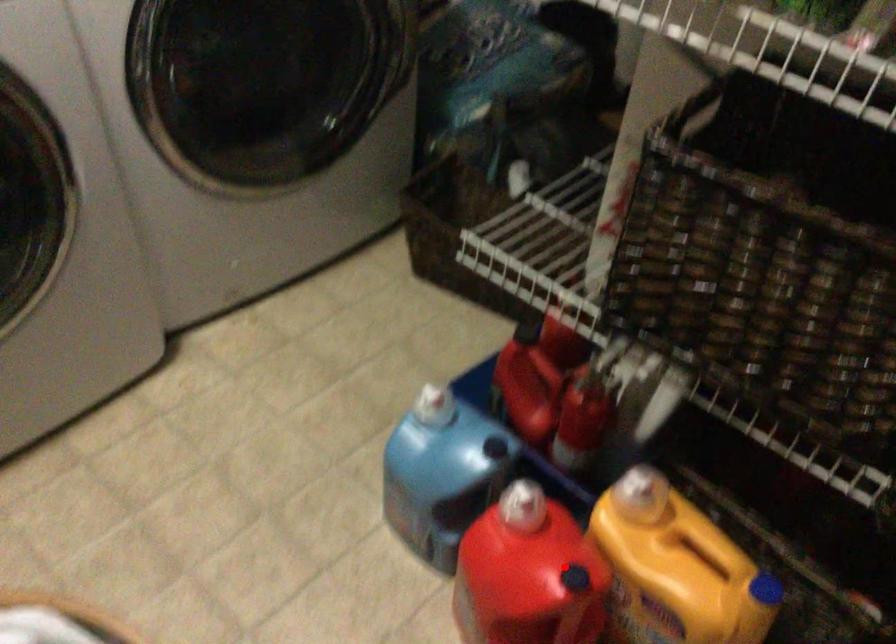
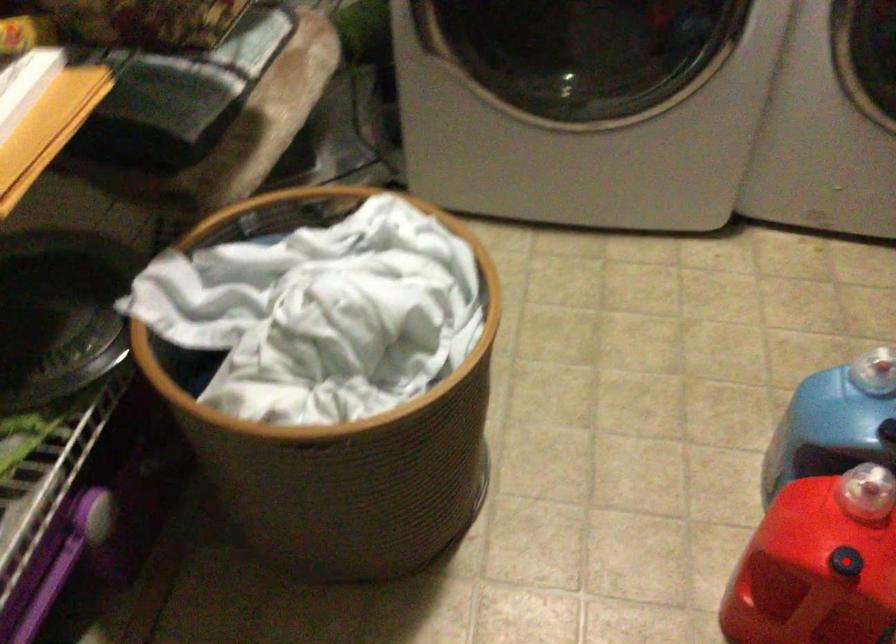
I am providing you with two images of the same scene from different viewpoints. A red point is marked on the first image and another point is marked on the second image. Do the highlighted points in image1 and image2 indicate the same real-world spot?

Yes